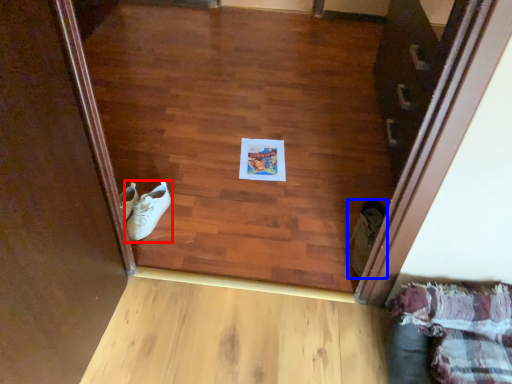
Question: Which of the following is the closest to the observer, footwear (highlighted by a red box) or footwear (highlighted by a blue box)?

Choices:
 (A) footwear
 (B) footwear

Answer: (B)